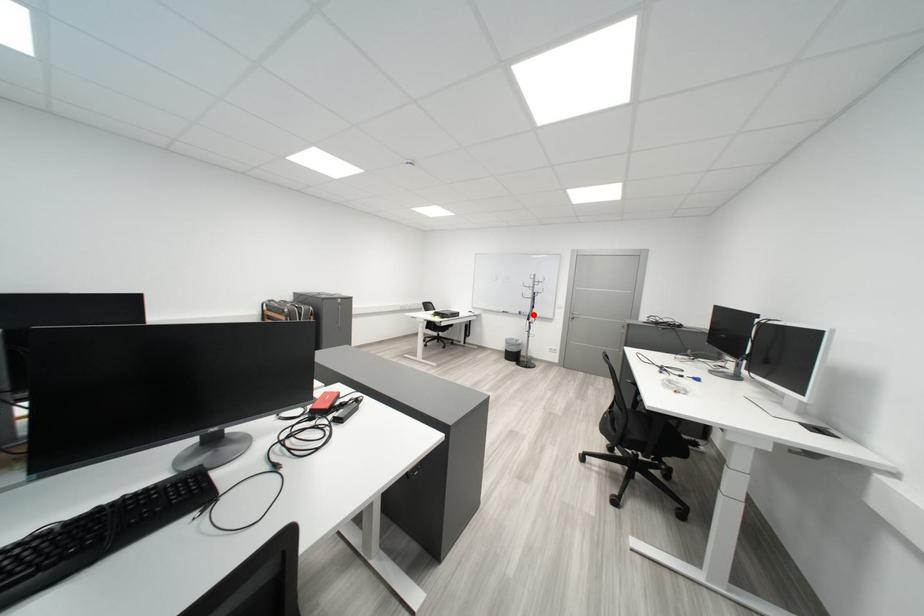
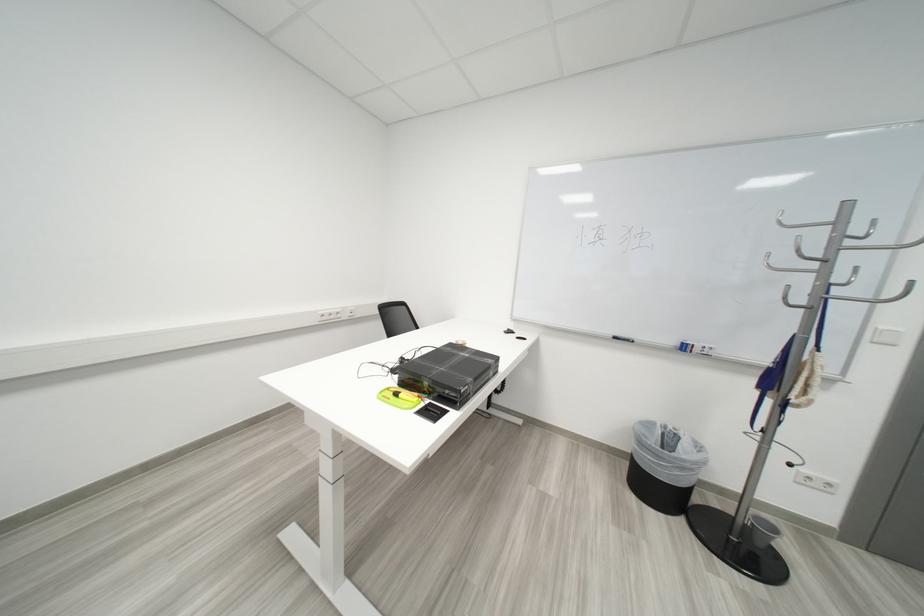
Where in the second image is the point corresponding to the highlighted location from the first image?

(698, 350)